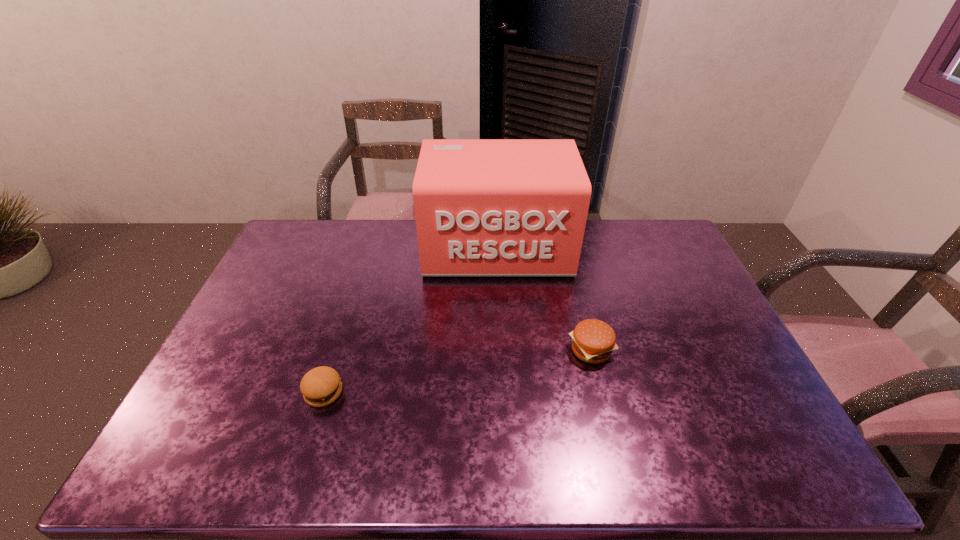
Identify the location of free region that satisfies the following two spatial constraints: 1. on the surface of the box where the text is embossed; 2. on the left side of the second nearest object. (503, 350).